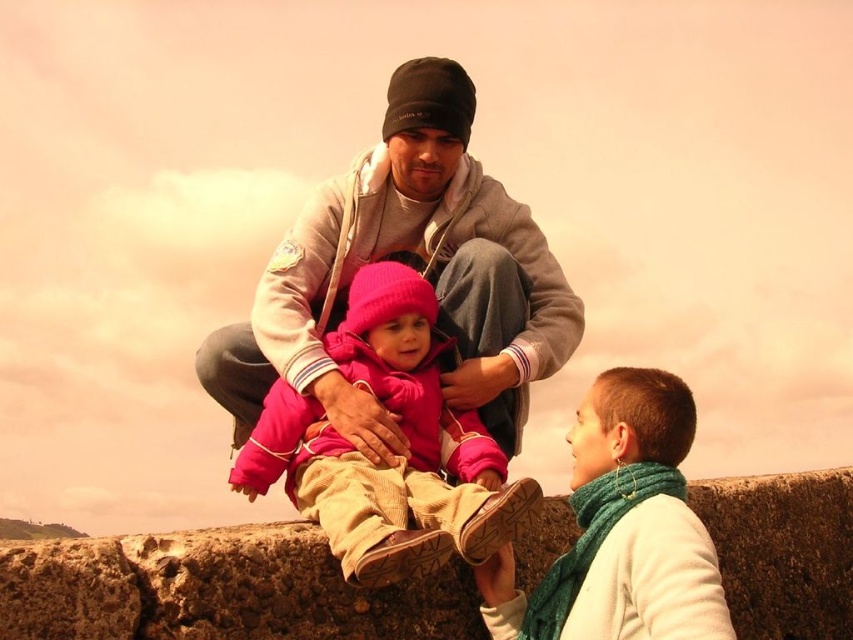
You are a photographer trying to capture a candid shot of the gray fleece jacket at center and the green knitted scarf at lower right. Which object should you focus on first if you want to ensure both are in the frame without moving the camera?

The gray fleece jacket at center is much taller than the green knitted scarf at lower right, so focusing on the taller gray fleece jacket at center first would help ensure both are in the frame without needing to adjust the camera position.

In the scene described, there is a pink fleece jacket at center and a green knitted scarf at lower right. Which of these two items is bigger in size?

The pink fleece jacket at center is larger in size compared to the green knitted scarf at lower right.